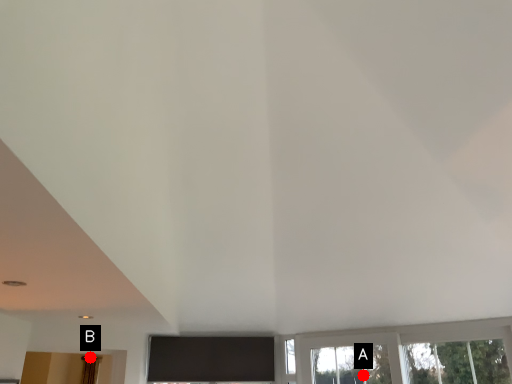
Question: Two points are circled on the image, labeled by A and B beside each circle. Among these points, which one is nearest to the camera?

Choices:
 (A) A is closer
 (B) B is closer

Answer: (B)